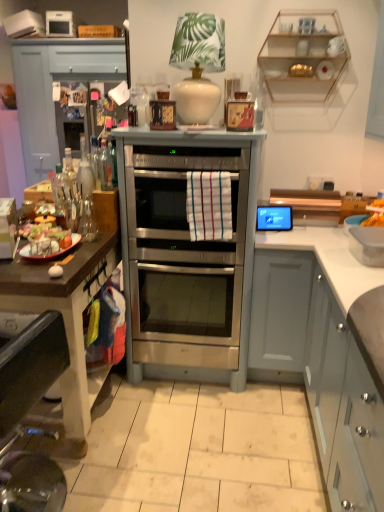
Question: From the image's perspective, is white matte cabinet at right, the 3th cabinetry when ordered from back to front, located beneath white matte cabinet at center, acting as the second cabinetry starting from the front?

Choices:
 (A) no
 (B) yes

Answer: (B)

Question: From a real-world perspective, is white matte cabinet at right, the 1th cabinetry ordered from the bottom, beneath white matte cabinet at center, acting as the second cabinetry starting from the front?

Choices:
 (A) yes
 (B) no

Answer: (A)

Question: Is white matte cabinet at right, the 1th cabinetry ordered from the bottom, far from white matte cabinet at center, the 2th cabinetry viewed from the left?

Choices:
 (A) no
 (B) yes

Answer: (A)

Question: Considering the relative sizes of white matte cabinet at right, marked as the first cabinetry in a front-to-back arrangement, and white matte cabinet at center, the second cabinetry from the top, in the image provided, is white matte cabinet at right, marked as the first cabinetry in a front-to-back arrangement, thinner than white matte cabinet at center, the second cabinetry from the top,?

Choices:
 (A) no
 (B) yes

Answer: (A)

Question: Does white matte cabinet at right, marked as the first cabinetry in a front-to-back arrangement, have a lesser height compared to white matte cabinet at center, the 2th cabinetry viewed from the back?

Choices:
 (A) no
 (B) yes

Answer: (B)

Question: Does white matte cabinet at right, marked as the first cabinetry in a front-to-back arrangement, come behind white matte cabinet at center, the second cabinetry from the top?

Choices:
 (A) yes
 (B) no

Answer: (B)

Question: Is shiny plastic tray at left, the 1th food positioned from the left, oriented towards clear glass bottle at left, arranged as the first bottle when viewed from the left?

Choices:
 (A) no
 (B) yes

Answer: (A)

Question: Is shiny plastic tray at left, arranged as the second food when viewed from the right, wider than clear glass bottle at left, arranged as the first bottle when viewed from the left?

Choices:
 (A) yes
 (B) no

Answer: (A)

Question: Is shiny plastic tray at left, arranged as the second food when viewed from the back, at the left side of clear glass bottle at left, acting as the 2th bottle starting from the right?

Choices:
 (A) no
 (B) yes

Answer: (A)

Question: Is shiny plastic tray at left, the 1th food in the front-to-back sequence, taller than clear glass bottle at left, arranged as the first bottle when viewed from the left?

Choices:
 (A) no
 (B) yes

Answer: (A)

Question: Is shiny plastic tray at left, the 1th food positioned from the left, directly adjacent to clear glass bottle at left, arranged as the first bottle when viewed from the left?

Choices:
 (A) no
 (B) yes

Answer: (A)

Question: Does shiny plastic tray at left, the 1th food in the front-to-back sequence, lie in front of clear glass bottle at left, arranged as the first bottle when viewed from the left?

Choices:
 (A) no
 (B) yes

Answer: (B)

Question: Would you say brushed metal drawer at upper left contains clear glass shelves at upper right?

Choices:
 (A) no
 (B) yes

Answer: (A)